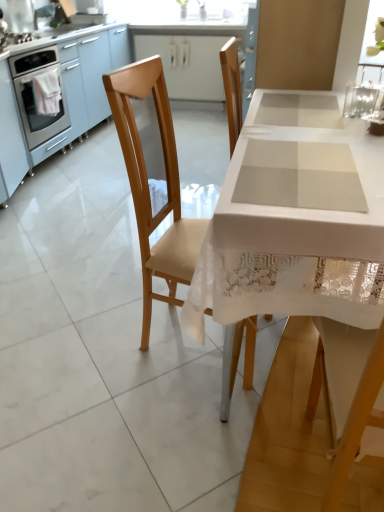
Question: Considering the relative sizes of wooden chair at left and stainless steel oven at left in the image provided, is wooden chair at left shorter than stainless steel oven at left?

Choices:
 (A) no
 (B) yes

Answer: (A)

Question: Is wooden chair at left completely or partially outside of stainless steel oven at left?

Choices:
 (A) no
 (B) yes

Answer: (B)

Question: Considering the relative sizes of wooden chair at left and stainless steel oven at left in the image provided, is wooden chair at left thinner than stainless steel oven at left?

Choices:
 (A) no
 (B) yes

Answer: (B)

Question: Is wooden chair at left facing away from stainless steel oven at left?

Choices:
 (A) no
 (B) yes

Answer: (A)

Question: From a real-world perspective, is wooden chair at left located beneath stainless steel oven at left?

Choices:
 (A) yes
 (B) no

Answer: (B)

Question: Is wooden chair at left to the left of stainless steel oven at left from the viewer's perspective?

Choices:
 (A) no
 (B) yes

Answer: (A)

Question: Is stainless steel oven at left taller than white lace table at center?

Choices:
 (A) yes
 (B) no

Answer: (B)

Question: Is stainless steel oven at left not inside white lace table at center?

Choices:
 (A) yes
 (B) no

Answer: (A)

Question: Is there a large distance between stainless steel oven at left and white lace table at center?

Choices:
 (A) yes
 (B) no

Answer: (A)

Question: Can you confirm if stainless steel oven at left is smaller than white lace table at center?

Choices:
 (A) yes
 (B) no

Answer: (A)

Question: Is the position of stainless steel oven at left less distant than that of white lace table at center?

Choices:
 (A) yes
 (B) no

Answer: (B)

Question: Does stainless steel oven at left have a larger size compared to white lace table at center?

Choices:
 (A) no
 (B) yes

Answer: (A)

Question: Can you confirm if white lace table at center is bigger than stainless steel oven at left?

Choices:
 (A) yes
 (B) no

Answer: (A)